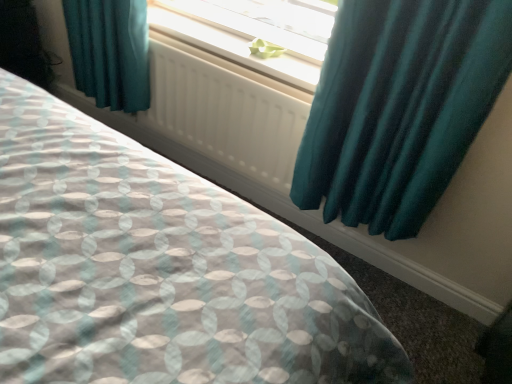
Question: Does teal satin curtain at upper right appear on the left side of green paper at center?

Choices:
 (A) yes
 (B) no

Answer: (B)

Question: Can you confirm if teal satin curtain at upper right is wider than green paper at center?

Choices:
 (A) yes
 (B) no

Answer: (A)

Question: Does teal satin curtain at upper right have a lesser height compared to green paper at center?

Choices:
 (A) yes
 (B) no

Answer: (B)

Question: Does teal satin curtain at upper right have a smaller size compared to green paper at center?

Choices:
 (A) yes
 (B) no

Answer: (B)

Question: From the image's perspective, is teal satin curtain at upper right above green paper at center?

Choices:
 (A) yes
 (B) no

Answer: (B)

Question: In terms of height, does green paper at center look taller or shorter compared to white matte radiator at center?

Choices:
 (A) short
 (B) tall

Answer: (A)

Question: Would you say green paper at center is to the left or to the right of white matte radiator at center in the picture?

Choices:
 (A) right
 (B) left

Answer: (A)

Question: Looking at their shapes, would you say green paper at center is wider or thinner than white matte radiator at center?

Choices:
 (A) thin
 (B) wide

Answer: (B)

Question: Considering their positions, is green paper at center located in front of or behind white matte radiator at center?

Choices:
 (A) behind
 (B) front

Answer: (A)

Question: Relative to white plastic radiator at upper center, is teal satin curtain at upper right in front or behind?

Choices:
 (A) behind
 (B) front

Answer: (B)

Question: Based on their sizes in the image, would you say teal satin curtain at upper right is bigger or smaller than white plastic radiator at upper center?

Choices:
 (A) small
 (B) big

Answer: (B)

Question: Is point (424, 157) closer or farther from the camera than point (211, 29)?

Choices:
 (A) closer
 (B) farther

Answer: (A)

Question: From the image's perspective, is teal satin curtain at upper right positioned above or below white plastic radiator at upper center?

Choices:
 (A) below
 (B) above

Answer: (A)

Question: Considering the relative positions of white plastic radiator at upper center and white matte radiator at center in the image provided, is white plastic radiator at upper center to the left or to the right of white matte radiator at center?

Choices:
 (A) right
 (B) left

Answer: (A)

Question: From a real-world perspective, relative to white matte radiator at center, is white plastic radiator at upper center vertically above or below?

Choices:
 (A) above
 (B) below

Answer: (A)